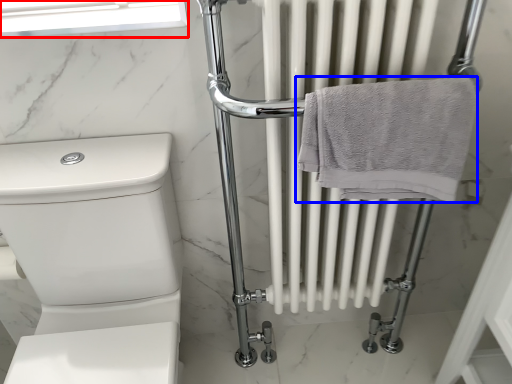
Question: Which object appears farthest to the camera in this image, window screen (highlighted by a red box) or towel (highlighted by a blue box)?

Choices:
 (A) window screen
 (B) towel

Answer: (A)